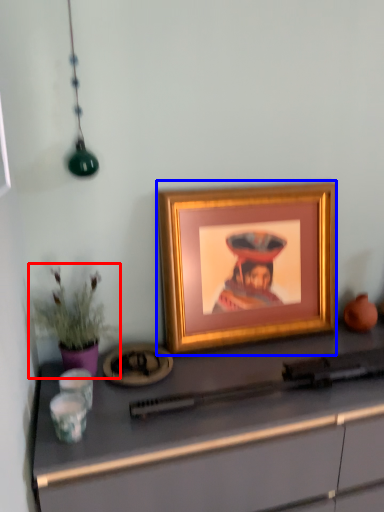
Question: Which of the following is the farthest to the observer, houseplant (highlighted by a red box) or picture frame (highlighted by a blue box)?

Choices:
 (A) houseplant
 (B) picture frame

Answer: (B)